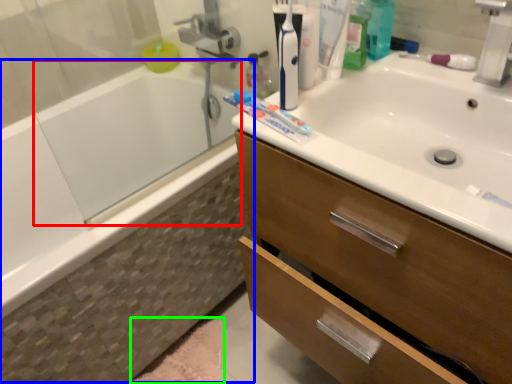
Question: Which object is the farthest from bath (highlighted by a red box)? Choose among these: bath (highlighted by a blue box) or bath mat (highlighted by a green box).

Choices:
 (A) bath
 (B) bath mat

Answer: (B)